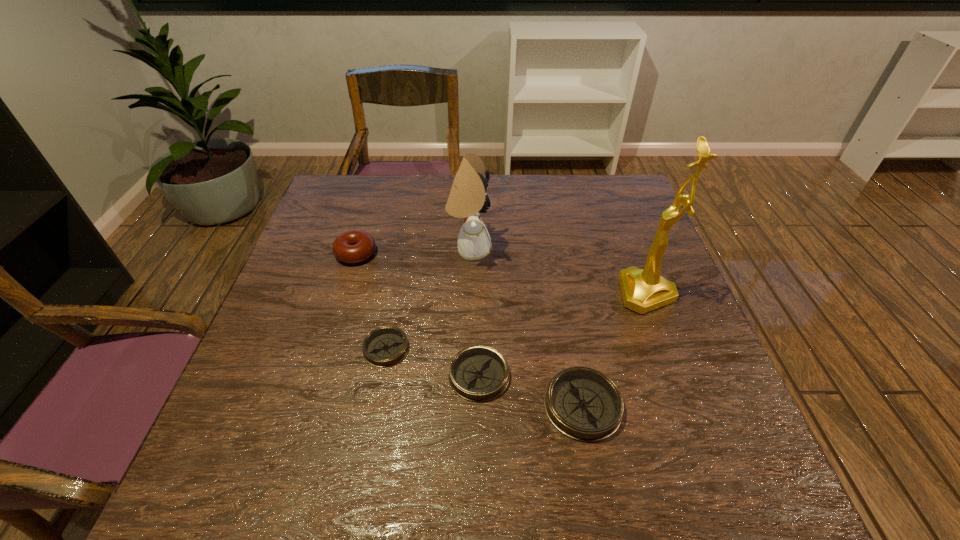
At what (x,y) coordinates should I click in order to perform the action: click on award. Please return your answer as a coordinate pair (x, y). Looking at the image, I should click on (643, 290).

Identify the location of free location located on the right of the leftmost compass. The height and width of the screenshot is (540, 960). (516, 348).

Where is `free space located 0.230m on the right of the second shortest compass`? This screenshot has height=540, width=960. free space located 0.230m on the right of the second shortest compass is located at coordinates (621, 375).

You are a GUI agent. You are given a task and a screenshot of the screen. Output one action in this format:
    pyautogui.click(x=<x>, y=<y>)
    Task: Click on the vacant space positioned 0.100m on the back of the third shortest object
    The width and height of the screenshot is (960, 540).
    Given the screenshot: What is the action you would take?
    pyautogui.click(x=569, y=335)

You are a GUI agent. You are given a task and a screenshot of the screen. Output one action in this format:
    pyautogui.click(x=<x>, y=<y>)
    Task: Click on the vacant space situated at the front face of the fifth shortest object
    The image size is (960, 540).
    Given the screenshot: What is the action you would take?
    pyautogui.click(x=559, y=249)

Find the location of a particular element. blank space located on the front of the fourth shortest object is located at coordinates (311, 399).

Where is `free space located on the front-facing side of the tallest object`? free space located on the front-facing side of the tallest object is located at coordinates (525, 293).

Where is `vacant space located 0.080m on the front-facing side of the tallest object`? The image size is (960, 540). vacant space located 0.080m on the front-facing side of the tallest object is located at coordinates (587, 293).

The height and width of the screenshot is (540, 960). Identify the location of blank space located on the front-facing side of the tallest object. (509, 293).

Locate an element on the screen. object at the left edge is located at coordinates (354, 246).